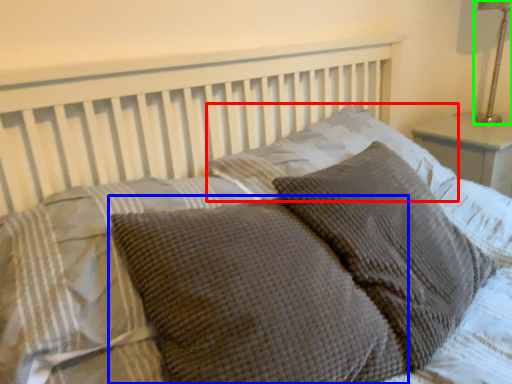
Question: Which is nearer to the pillow (highlighted by a red box)? pillow (highlighted by a blue box) or bedside lamp (highlighted by a green box).

Choices:
 (A) pillow
 (B) bedside lamp

Answer: (A)